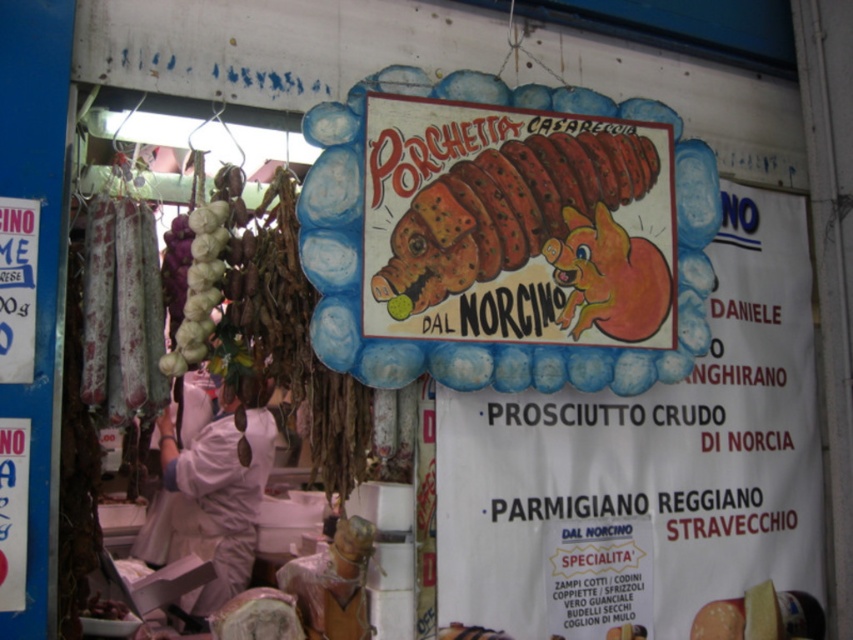
You are a customer at the market stall and want to buy the largest item displayed. Which item should you choose between the matte orange pig at center and the sliced brown meat at center?

The matte orange pig at center is bigger than the sliced brown meat at center, so you should choose the matte orange pig at center.

You are a customer at the market stall and want to locate the matte orange pig at center. What are the coordinates where you can find it?

The matte orange pig at center is located at coordinates point (653,474).

Based on the photo, you are a customer at the market stall looking for the Porchetta Casareccia. You see the matte orange pig at center and the sliced brown meat at center. According to the arrangement, which item is positioned to the right of the other?

The matte orange pig at center is to the right of the sliced brown meat at center.